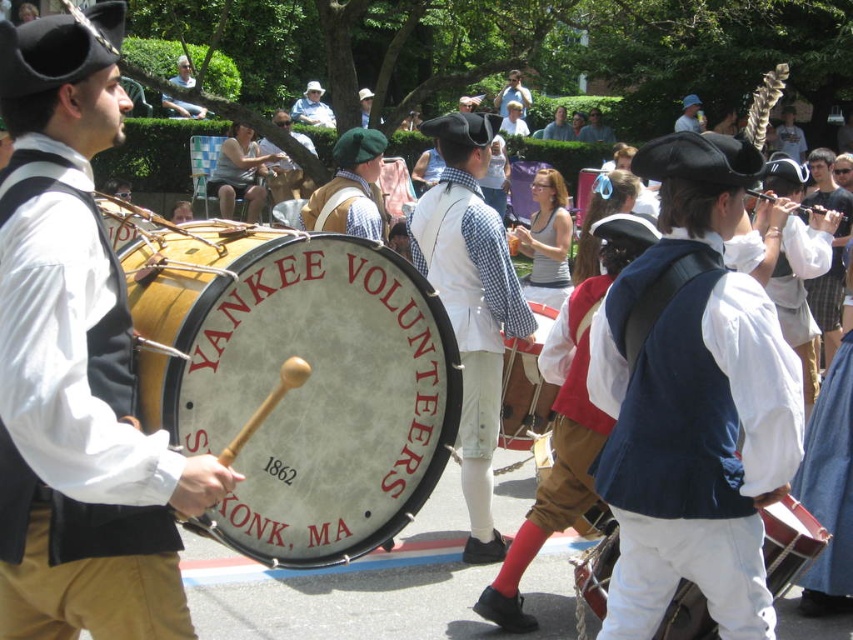
Who is lower down, matte white drum at center or light brown leather hat at upper center?

matte white drum at center

Can you confirm if matte white drum at center is positioned to the left of light brown leather hat at upper center?

No, matte white drum at center is not to the left of light brown leather hat at upper center.

Describe the element at coordinates (525, 387) in the screenshot. I see `matte white drum at center` at that location.

Find the location of `matte white drum at center`. matte white drum at center is located at coordinates (525, 387).

Is white checkered shirt at center wider than matte brown drum at center?

No.

Is white checkered shirt at center shorter than matte brown drum at center?

No.

Who is more distant from viewer, (466,285) or (115,212)?

Positioned behind is point (466,285).

Identify the location of white checkered shirt at center. Image resolution: width=853 pixels, height=640 pixels. (471, 301).

Does matte white drum at center have a lesser width compared to matte brown drum at center?

Indeed, matte white drum at center has a lesser width compared to matte brown drum at center.

Is point (502, 388) farther from camera compared to point (117, 221)?

Yes, it is behind point (117, 221).

What are the coordinates of `matte white drum at center` in the screenshot? It's located at (525, 387).